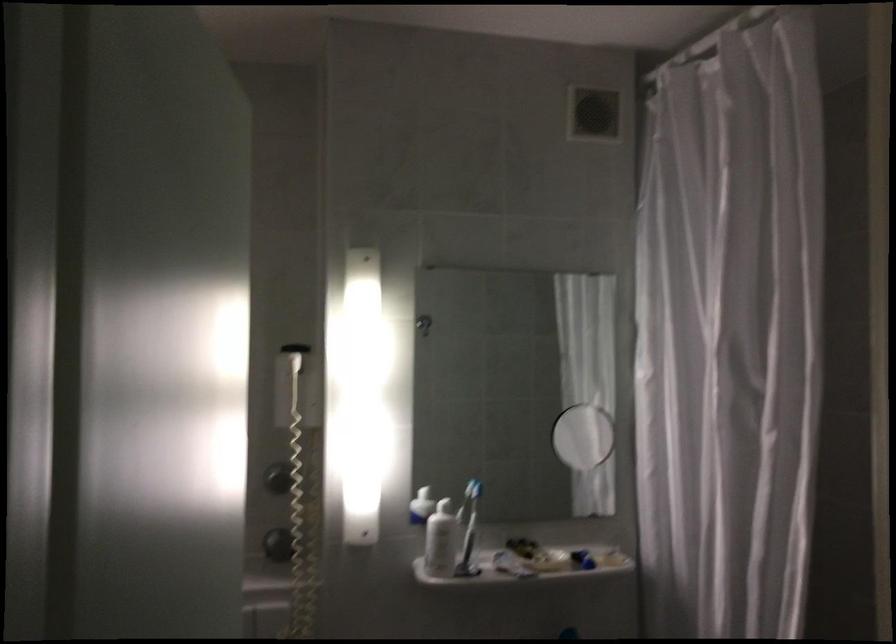
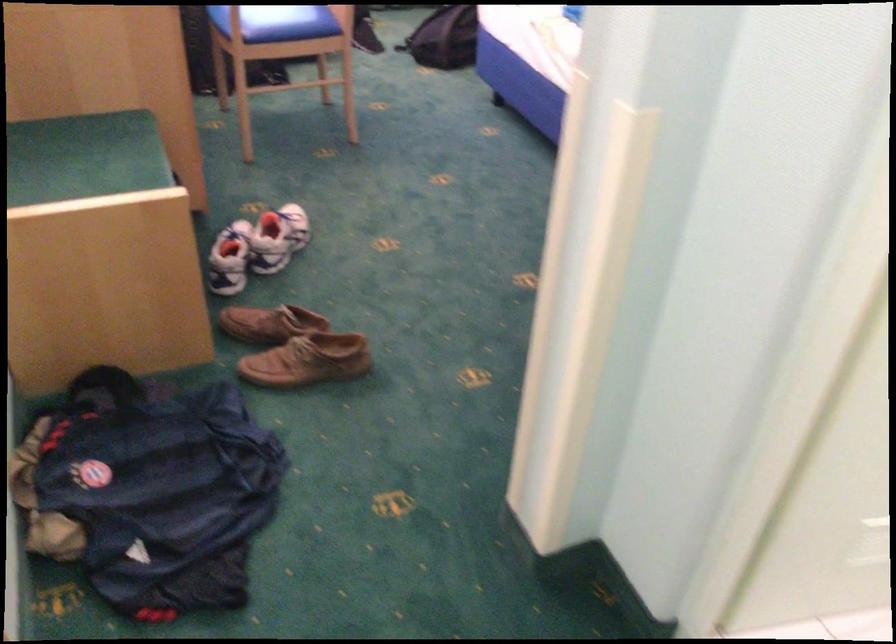
Based on the continuous images, in which direction is the camera rotating?

The rotation direction of the camera is left-down.